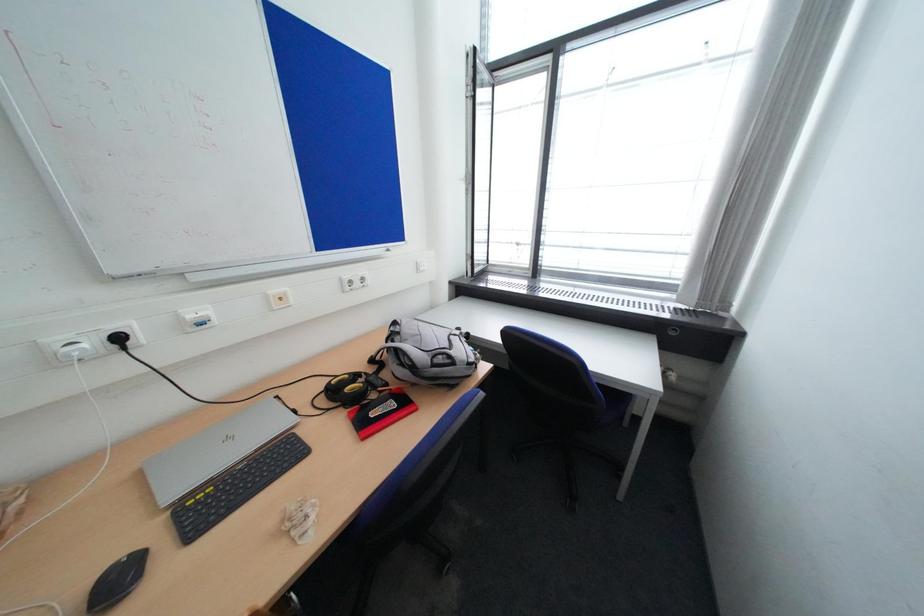
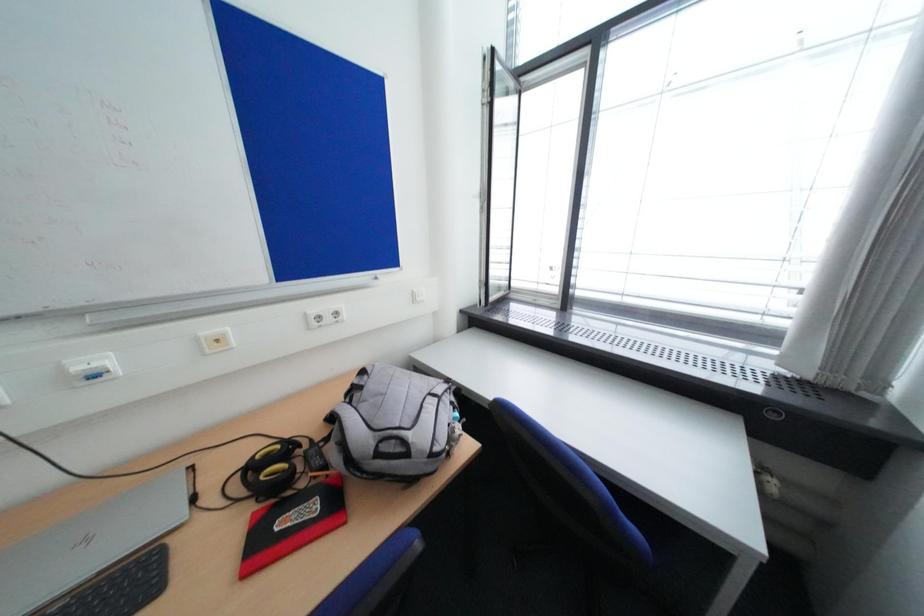
Question: The camera is either moving clockwise (left) or counter-clockwise (right) around the object. The first image is from the beginning of the video and the second image is from the end. Is the camera moving left or right when shooting the video?

Choices:
 (A) Left
 (B) Right

Answer: (B)